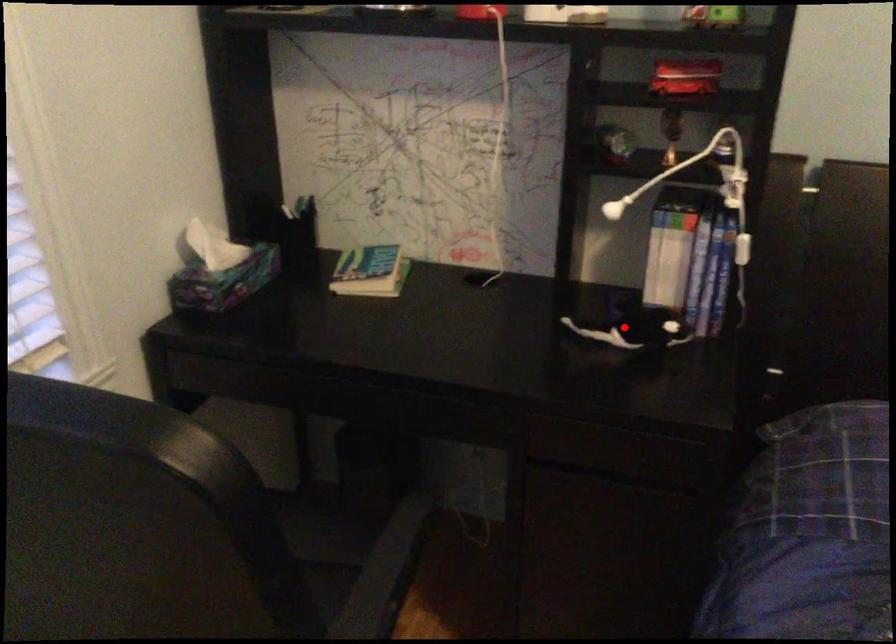
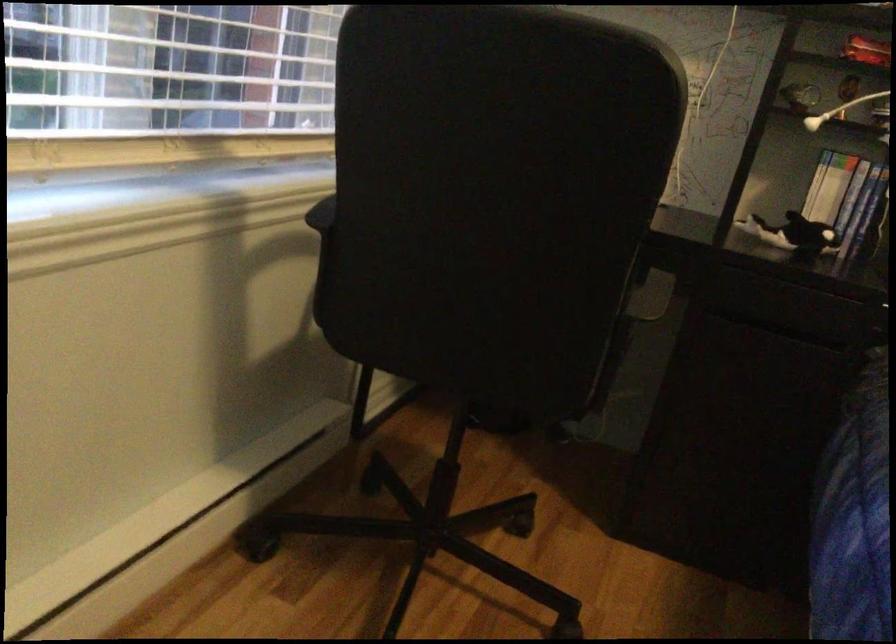
Question: I am providing you with two images of the same scene from different viewpoints. In image1, a red point is highlighted. Considering the same 3D point in image2, which of the following is correct?

Choices:
 (A) It is closer
 (B) It is farther

Answer: (B)